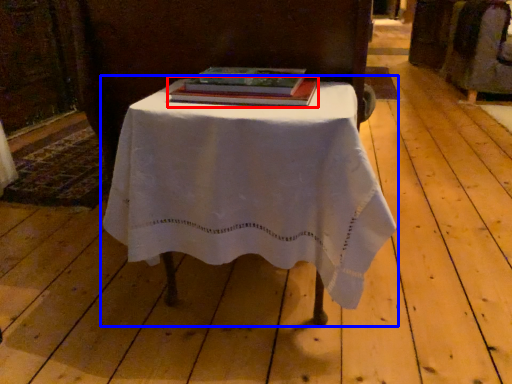
Question: Which point is closer to the camera, book (highlighted by a red box) or table (highlighted by a blue box)?

Choices:
 (A) book
 (B) table

Answer: (B)